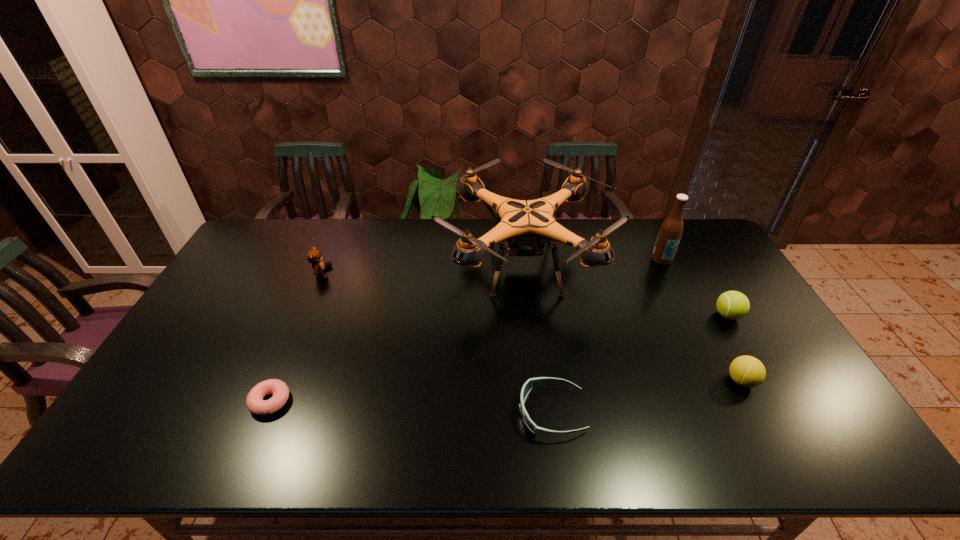
This screenshot has width=960, height=540. Find the location of `object that is at the near edge`. object that is at the near edge is located at coordinates (527, 387).

In the image, there is a desktop. Where is `free space at the far edge`? free space at the far edge is located at coordinates (372, 228).

At what (x,y) coordinates should I click in order to perform the action: click on free region at the near edge of the desktop. Please return your answer as a coordinate pair (x, y). The width and height of the screenshot is (960, 540). Looking at the image, I should click on (557, 438).

At what (x,y) coordinates should I click in order to perform the action: click on free point at the right edge. Please return your answer as a coordinate pair (x, y). The width and height of the screenshot is (960, 540). Looking at the image, I should click on (799, 389).

In the image, there is a desktop. Where is `vacant space at the far left corner`? vacant space at the far left corner is located at coordinates (278, 232).

At what (x,y) coordinates should I click in order to perform the action: click on free area in between the sixth tallest object and the doughnut. Please return your answer as a coordinate pair (x, y). This screenshot has width=960, height=540. Looking at the image, I should click on (411, 407).

Where is `empty space between the sixth tallest object and the farther tennis ball`? The height and width of the screenshot is (540, 960). empty space between the sixth tallest object and the farther tennis ball is located at coordinates (639, 363).

At what (x,y) coordinates should I click in order to perform the action: click on vacant space in between the sixth tallest object and the beer bottle. Please return your answer as a coordinate pair (x, y). Looking at the image, I should click on (607, 335).

Identify the location of vacant area that lies between the doughnut and the nearer tennis ball. Image resolution: width=960 pixels, height=540 pixels. (506, 391).

Find the location of a particular element. unoccupied position between the nearer tennis ball and the farther tennis ball is located at coordinates (734, 348).